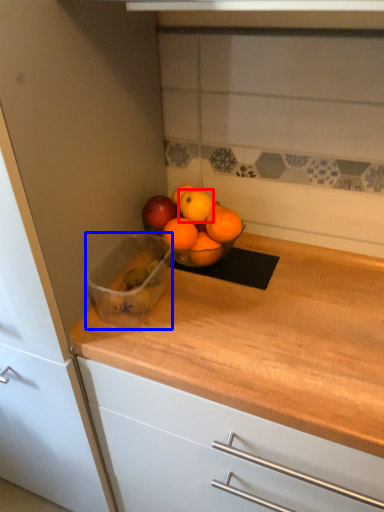
Question: Which of the following is the closest to the observer, orange (highlighted by a red box) or glass bowl (highlighted by a blue box)?

Choices:
 (A) orange
 (B) glass bowl

Answer: (B)